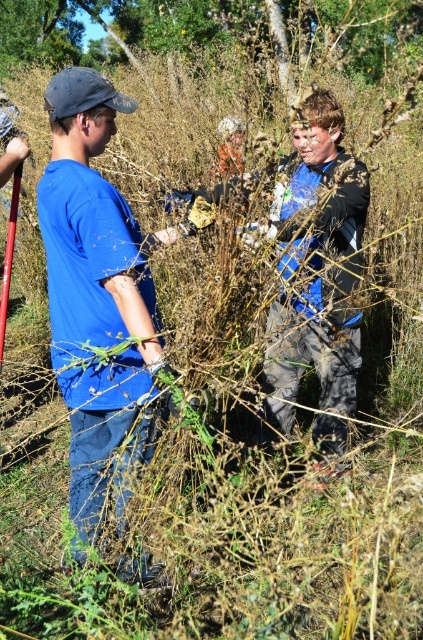
Question: Does blue cotton shirt at left have a greater width compared to green leafy tree at upper center?

Choices:
 (A) no
 (B) yes

Answer: (A)

Question: Does blue cotton shirt at left have a lesser width compared to green leafy tree at upper center?

Choices:
 (A) yes
 (B) no

Answer: (A)

Question: Which point is closer to the camera taking this photo?

Choices:
 (A) (96, 3)
 (B) (107, 456)

Answer: (B)

Question: Which point is closer to the camera taking this photo?

Choices:
 (A) (102, 202)
 (B) (365, 19)

Answer: (A)

Question: Which object is closer to the camera taking this photo?

Choices:
 (A) blue cotton shirt at left
 (B) green leafy tree at upper center

Answer: (A)

Question: Can you confirm if blue cotton shirt at left is positioned below green leafy tree at upper center?

Choices:
 (A) yes
 (B) no

Answer: (A)